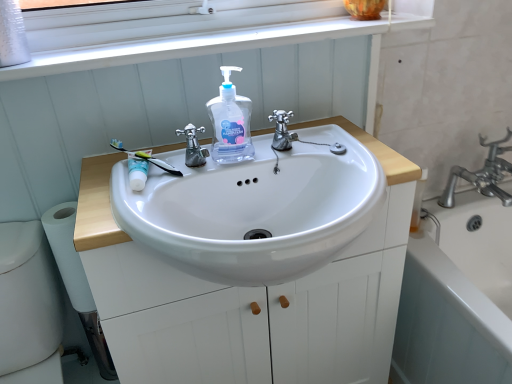
This screenshot has height=384, width=512. I want to click on empty space that is to the right of polished chrome faucet at center, which is the 2th tap in left-to-right order, so click(348, 154).